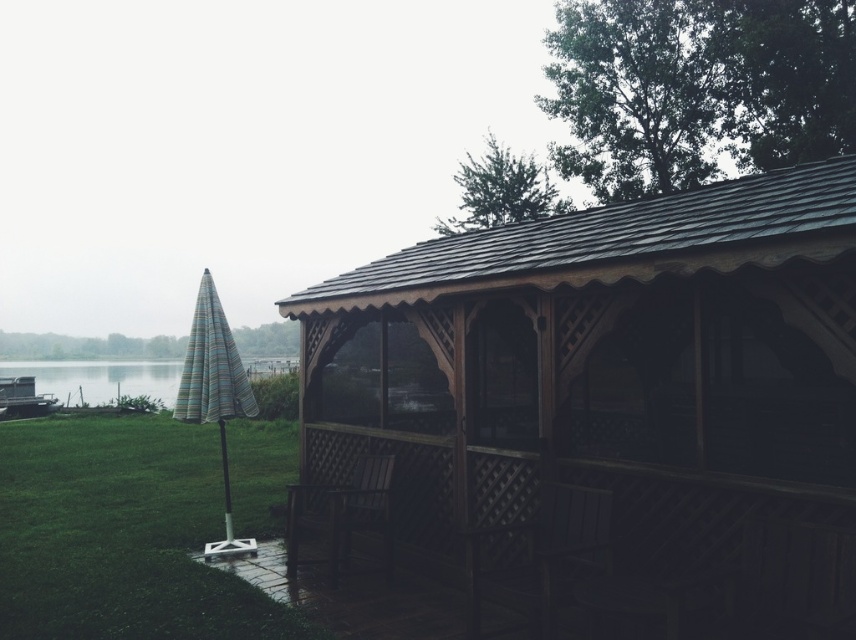
You are standing at the edge of the lake and want to place a small picnic basket on the green grass at lower left. According to the coordinates provided, where exactly should you place it?

The green grass at lower left is located at coordinates point (120, 536), so you should place the picnic basket there.

You are standing at the lakeside and want to reach the point marked as point (9, 436). Given that the distance from you to this point is 16.85 meters, can you estimate how far you need to walk to reach it?

The point (9, 436) is 16.85 meters away from the viewer, so you need to walk approximately 16.85 meters to reach it.